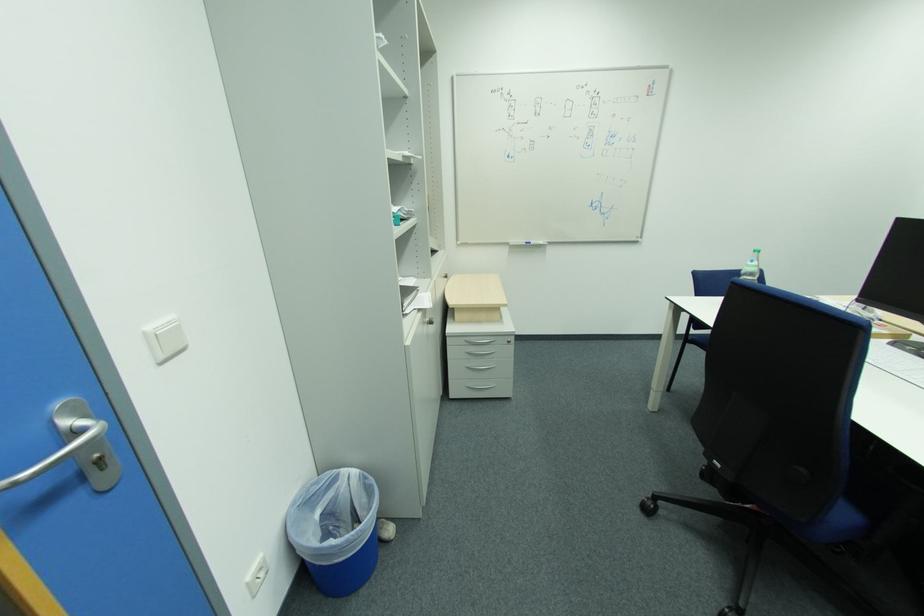
Locate an element on the screen. silver cabinet knob is located at coordinates (429, 321).